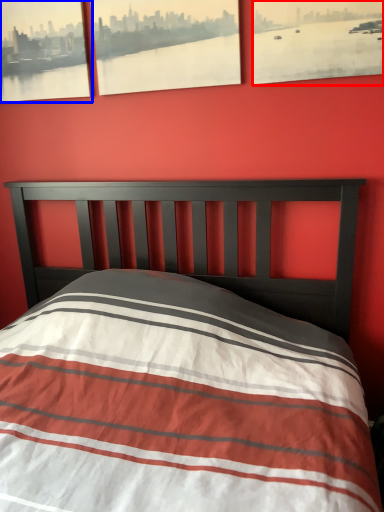
Question: Which object is closer to the camera taking this photo, picture frame (highlighted by a red box) or picture frame (highlighted by a blue box)?

Choices:
 (A) picture frame
 (B) picture frame

Answer: (A)